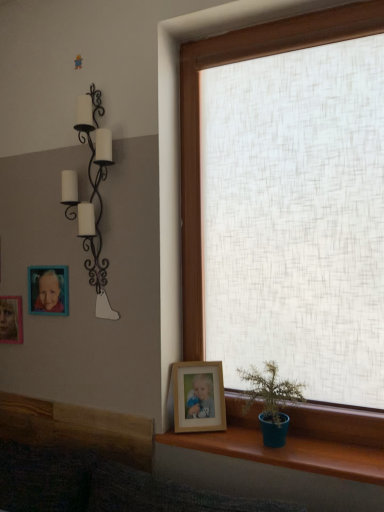
Where is `vacant space underneath teal ceramic pot at lower right (from a real-world perspective)`? vacant space underneath teal ceramic pot at lower right (from a real-world perspective) is located at coordinates (268, 445).